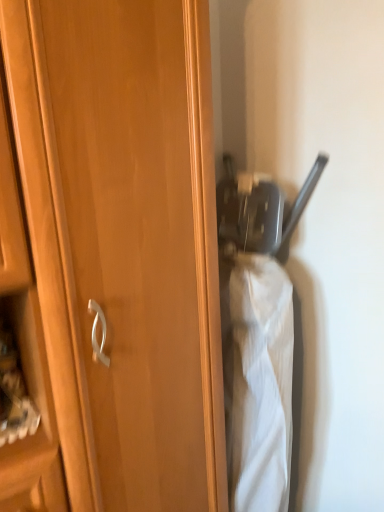
Describe the element at coordinates (124, 241) in the screenshot. The height and width of the screenshot is (512, 384). I see `wooden cupboard at center` at that location.

Locate an element on the screen. wooden cupboard at center is located at coordinates (124, 241).

This screenshot has height=512, width=384. Describe the element at coordinates (258, 336) in the screenshot. I see `matte black umbrella at center` at that location.

Measure the distance between matte black umbrella at center and camera.

They are 3.33 feet apart.

This screenshot has width=384, height=512. I want to click on matte black umbrella at center, so click(x=258, y=336).

Measure the distance between point (244, 355) and camera.

Point (244, 355) is 3.73 feet away from camera.

Where is `wooden cupboard at center`? wooden cupboard at center is located at coordinates coord(124,241).

Considering the positions of objects matte black umbrella at center and wooden cupboard at center in the image provided, who is more to the right, matte black umbrella at center or wooden cupboard at center?

Positioned to the right is matte black umbrella at center.

Consider the image. Considering their positions, is matte black umbrella at center located in front of or behind wooden cupboard at center?

matte black umbrella at center is positioned farther from the viewer than wooden cupboard at center.

Does point (255, 410) come closer to viewer compared to point (150, 88)?

That is False.

From the image's perspective, would you say matte black umbrella at center is shown under wooden cupboard at center?

Yes, from the image's perspective, matte black umbrella at center is below wooden cupboard at center.

From a real-world perspective, is matte black umbrella at center positioned under wooden cupboard at center based on gravity?

Yes, from a real-world perspective, matte black umbrella at center is under wooden cupboard at center.

Is matte black umbrella at center wider or thinner than wooden cupboard at center?

In the image, matte black umbrella at center appears to be wider than wooden cupboard at center.

Does matte black umbrella at center have a lesser height compared to wooden cupboard at center?

Yes.

Does matte black umbrella at center have a smaller size compared to wooden cupboard at center?

Correct, matte black umbrella at center occupies less space than wooden cupboard at center.

Is wooden cupboard at center completely or partially inside matte black umbrella at center?

No, wooden cupboard at center is located outside of matte black umbrella at center.

Is there a large distance between matte black umbrella at center and wooden cupboard at center?

matte black umbrella at center is actually quite close to wooden cupboard at center.

In the scene shown: Could you tell me if matte black umbrella at center is turned towards wooden cupboard at center?

No, matte black umbrella at center is not turned towards wooden cupboard at center.

How different are the orientations of matte black umbrella at center and wooden cupboard at center in degrees?

They differ by 0.000121 degrees in their facing directions.

Locate an element on the screen. The height and width of the screenshot is (512, 384). cupboard in front of the matte black umbrella at center is located at coordinates (124, 241).

Is wooden cupboard at center at the left side of matte black umbrella at center?

Yes, wooden cupboard at center is to the left of matte black umbrella at center.

In the scene shown: Is wooden cupboard at center closer to camera compared to matte black umbrella at center?

Yes, wooden cupboard at center is closer to the camera.

Between point (199, 337) and point (278, 492), which one is positioned behind?

The point (278, 492) is farther.

From the image's perspective, is wooden cupboard at center positioned above or below matte black umbrella at center?

From the image's perspective, wooden cupboard at center appears above matte black umbrella at center.

From a real-world perspective, does wooden cupboard at center sit lower than matte black umbrella at center?

No, from a real-world perspective, wooden cupboard at center is not below matte black umbrella at center.

Looking at this image, can you confirm if wooden cupboard at center is wider than matte black umbrella at center?

No, wooden cupboard at center is not wider than matte black umbrella at center.

Does wooden cupboard at center have a greater height compared to matte black umbrella at center?

Correct, wooden cupboard at center is much taller as matte black umbrella at center.

Which of these two, wooden cupboard at center or matte black umbrella at center, is smaller?

matte black umbrella at center is smaller.

Choose the correct answer: Is wooden cupboard at center inside matte black umbrella at center or outside it?

wooden cupboard at center lies outside matte black umbrella at center.

Is wooden cupboard at center far away from matte black umbrella at center?

No, wooden cupboard at center is not far away from matte black umbrella at center.

Could you tell me if wooden cupboard at center is turned towards matte black umbrella at center?

No, wooden cupboard at center is not oriented towards matte black umbrella at center.

What's the angular difference between wooden cupboard at center and matte black umbrella at center's facing directions?

They differ by 0.000121 degrees in their facing directions.

How much distance is there between wooden cupboard at center and matte black umbrella at center?

wooden cupboard at center and matte black umbrella at center are 11.33 inches apart.

At what (x,y) coordinates should I click in order to perform the action: click on cupboard that appears above the matte black umbrella at center (from the image's perspective). Please return your answer as a coordinate pair (x, y). The height and width of the screenshot is (512, 384). Looking at the image, I should click on [124, 241].

Image resolution: width=384 pixels, height=512 pixels. In order to click on wide lying below the wooden cupboard at center (from the image's perspective) in this screenshot , I will do `click(258, 336)`.

There is a matte black umbrella at center. Where is `cupboard above it (from a real-world perspective)`? This screenshot has height=512, width=384. cupboard above it (from a real-world perspective) is located at coordinates (124, 241).